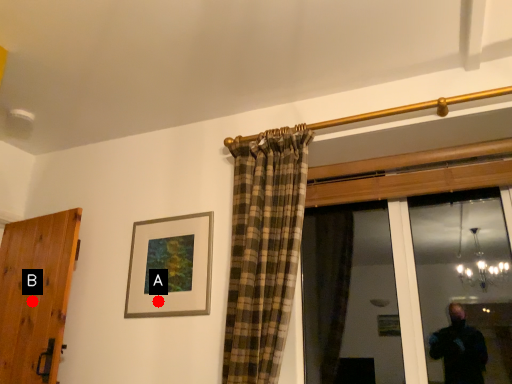
Question: Two points are circled on the image, labeled by A and B beside each circle. Among these points, which one is farthest from the camera?

Choices:
 (A) A is further
 (B) B is further

Answer: (B)